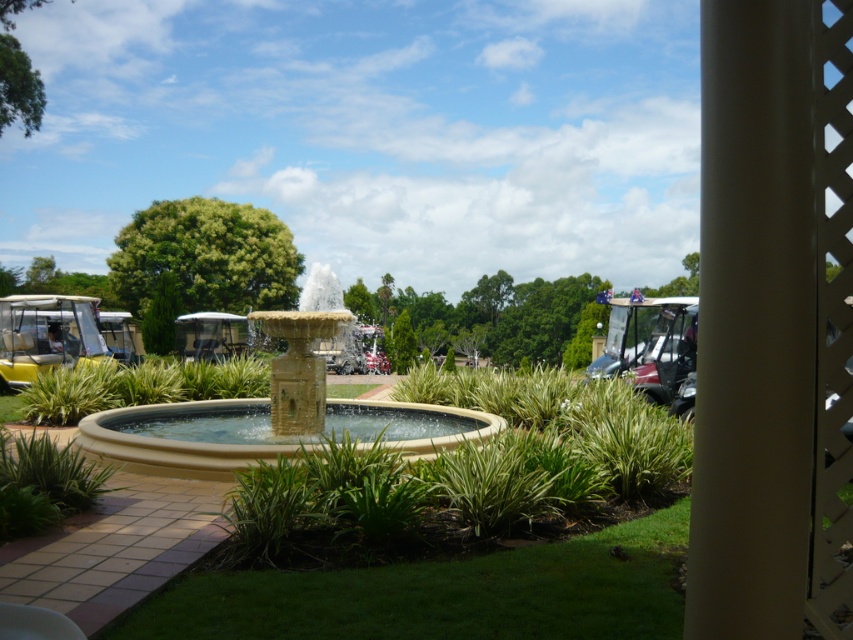
You are standing at the point marked by coordinates point [268,428] in the image. What object is located exactly at that point?

The point [268,428] indicates the beige stone fountain at center.

You are a visitor at the golf course and want to take a photo of the beige stone fountain at center and the black plastic golf cart at right. If you stand at the center of the pathway, which object will appear on your left side in the photo?

The beige stone fountain at center is to the left of the black plastic golf cart at right, so when standing at the center of the pathway, the beige stone fountain at center will appear on your left side in the photo.

You are standing at the fountain in the center of the circular pool and want to walk to the golf carts parked in the background. Which direction should you walk to reach the golf carts first, towards point (701, 272) or point (489, 422)?

You should walk towards point (489, 422) because it is further away from the viewer, meaning the golf carts are located in that direction.